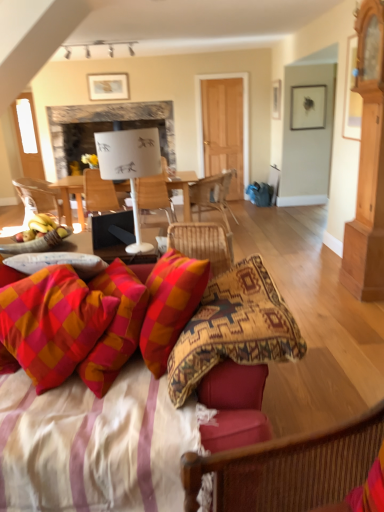
Question: Does white paperboard at center have a greater height compared to woven wood chair at center, marked as the first chair in a right-to-left arrangement?

Choices:
 (A) no
 (B) yes

Answer: (B)

Question: Is white paperboard at center closer to the viewer compared to woven wood chair at center, marked as the first chair in a right-to-left arrangement?

Choices:
 (A) no
 (B) yes

Answer: (A)

Question: Does white paperboard at center appear on the right side of woven wood chair at center, which is the first chair from back to front?

Choices:
 (A) yes
 (B) no

Answer: (B)

Question: Would you say woven wood chair at center, which is counted as the fourth chair, starting from the front, is part of white paperboard at center's contents?

Choices:
 (A) yes
 (B) no

Answer: (B)

Question: Does white paperboard at center have a smaller size compared to woven wood chair at center, which is the first chair from back to front?

Choices:
 (A) yes
 (B) no

Answer: (B)

Question: Do you think white paperboard at center is within yellow bananas at left, or outside of it?

Choices:
 (A) inside
 (B) outside

Answer: (B)

Question: Considering the positions of white paperboard at center and yellow bananas at left in the image, is white paperboard at center wider or thinner than yellow bananas at left?

Choices:
 (A) wide
 (B) thin

Answer: (A)

Question: Considering the positions of point (137, 103) and point (33, 227), is point (137, 103) closer or farther from the camera than point (33, 227)?

Choices:
 (A) closer
 (B) farther

Answer: (B)

Question: Considering their positions, is white paperboard at center located in front of or behind yellow bananas at left?

Choices:
 (A) behind
 (B) front

Answer: (A)

Question: Does point (52, 365) appear closer or farther from the camera than point (36, 221)?

Choices:
 (A) farther
 (B) closer

Answer: (B)

Question: In the image, is plaid fabric pillow at lower left positioned in front of or behind yellow bananas at left?

Choices:
 (A) behind
 (B) front

Answer: (B)

Question: Looking at their shapes, would you say plaid fabric pillow at lower left is wider or thinner than yellow bananas at left?

Choices:
 (A) wide
 (B) thin

Answer: (A)

Question: From a real-world perspective, is plaid fabric pillow at lower left positioned above or below yellow bananas at left?

Choices:
 (A) above
 (B) below

Answer: (B)

Question: Does point (18, 373) appear closer or farther from the camera than point (28, 282)?

Choices:
 (A) closer
 (B) farther

Answer: (A)

Question: From the image's perspective, relative to plaid fabric pillow at lower left, is textured fabric couch at lower center above or below?

Choices:
 (A) below
 (B) above

Answer: (A)